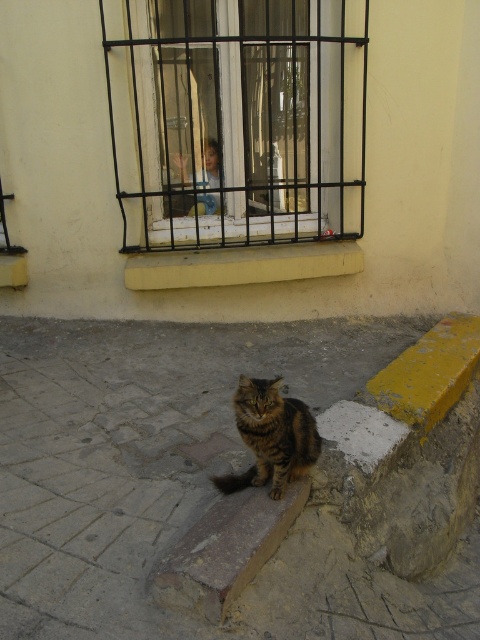
You are standing in the urban scene and want to take a photo of the black metal bars at upper center and the yellow concrete at center. Which object should you focus on first to ensure both are in clear view?

You should focus on the black metal bars at upper center first since it is closer to the viewer than the yellow concrete at center, ensuring both are in clear view by adjusting the focus accordingly.

You are a drone operator trying to capture a photo of the cat and the child. You need to adjust your camera to focus on both points simultaneously. Since the points are at different distances, which point should you focus on to ensure the cat and the child are both in focus? Remember, the cat is at point (141, 42) and the child is at point (225, 276).

You should focus on point (225, 276) because it is farther away than point (141, 42). When focusing on the farther point, the depth of field will include the closer point as well, ensuring both the cat and the child are in focus.